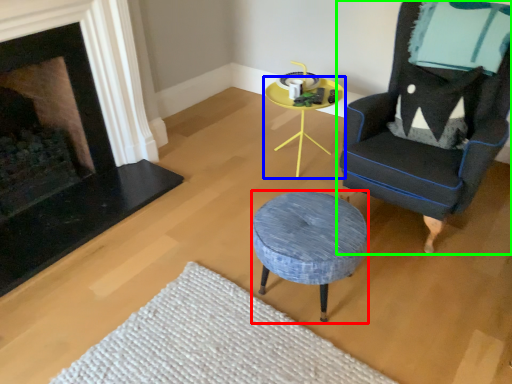
Question: Which object is the farthest from stool (highlighted by a red box)? Choose among these: table (highlighted by a blue box) or chair (highlighted by a green box).

Choices:
 (A) table
 (B) chair

Answer: (A)